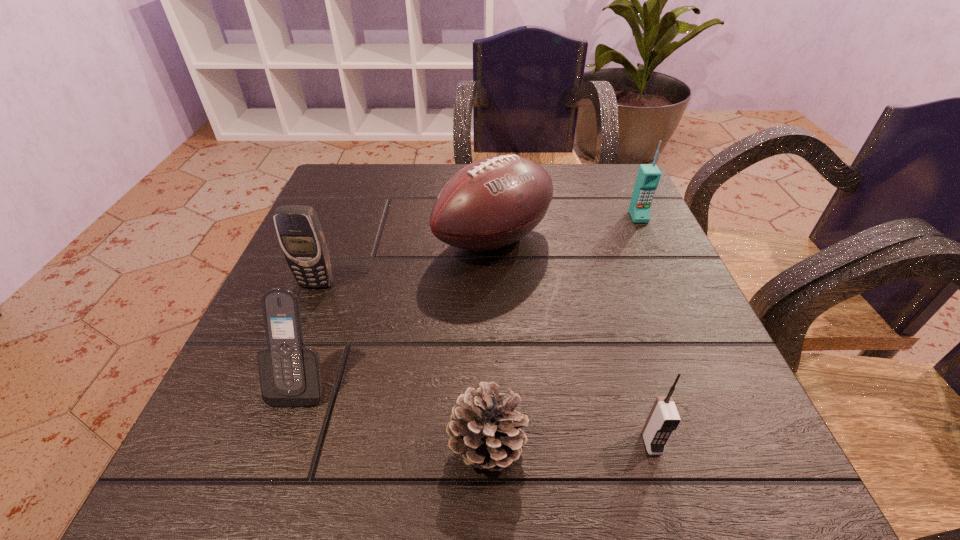
This screenshot has width=960, height=540. What are the coordinates of `football (American)` in the screenshot? It's located at (493, 202).

The image size is (960, 540). I want to click on the farthest cellular telephone, so click(648, 177).

Find the location of `the rightmost object`. the rightmost object is located at coordinates (648, 177).

Identify the location of the second farthest cellular telephone. This screenshot has height=540, width=960. (300, 234).

Image resolution: width=960 pixels, height=540 pixels. In order to click on the second nearest cellular telephone in this screenshot , I will do `click(290, 376)`.

In order to click on the nearest cellular telephone in this screenshot , I will do `click(663, 419)`.

This screenshot has height=540, width=960. Identify the location of the second object from right to left. (663, 419).

The height and width of the screenshot is (540, 960). I want to click on the shortest object, so click(x=484, y=428).

Find the location of a particular element. This screenshot has height=540, width=960. vacant space located 0.280m on the front of the football (American) is located at coordinates (500, 400).

At what (x,y) coordinates should I click in order to perform the action: click on vacant area situated 0.350m on the keypad of the rightmost cellular telephone. Please return your answer as a coordinate pair (x, y). The height and width of the screenshot is (540, 960). Looking at the image, I should click on (699, 347).